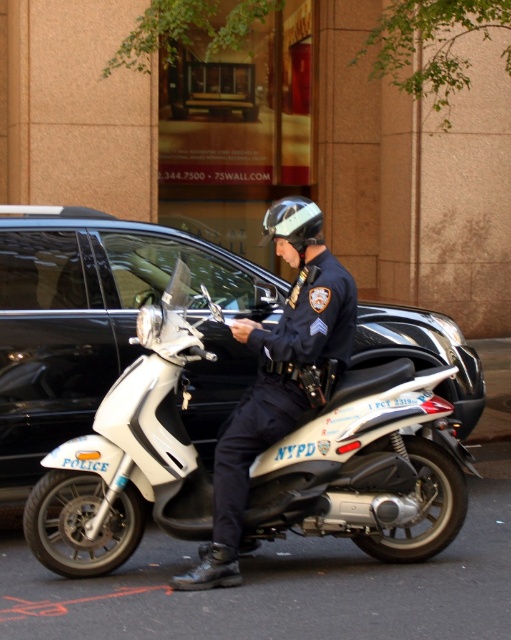
Question: Among these objects, which one is nearest to the camera?

Choices:
 (A) navy blue uniform at center
 (B) white matte scooter at center

Answer: (A)

Question: Does white matte scooter at center have a lesser width compared to navy blue uniform at center?

Choices:
 (A) yes
 (B) no

Answer: (B)

Question: Does white matte scooter at center have a greater width compared to navy blue uniform at center?

Choices:
 (A) no
 (B) yes

Answer: (B)

Question: From the image, what is the correct spatial relationship of white matte scooter at center in relation to navy blue uniform at center?

Choices:
 (A) right
 (B) left

Answer: (B)